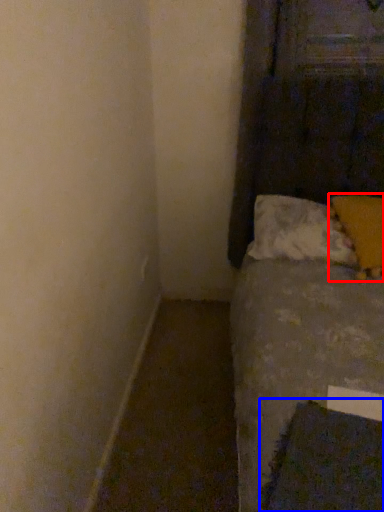
Question: Among these objects, which one is farthest to the camera, pillow (highlighted by a red box) or sheet (highlighted by a blue box)?

Choices:
 (A) pillow
 (B) sheet

Answer: (A)